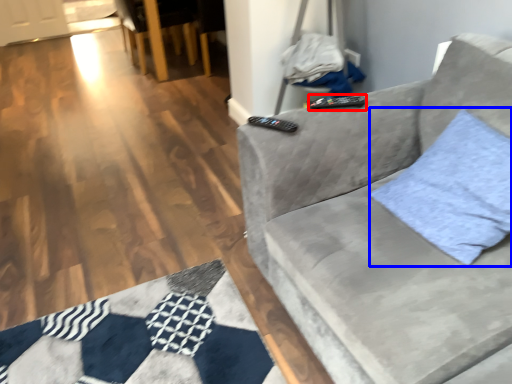
Question: Which of the following is the farthest to the observer, remote (highlighted by a red box) or throw pillow (highlighted by a blue box)?

Choices:
 (A) remote
 (B) throw pillow

Answer: (A)